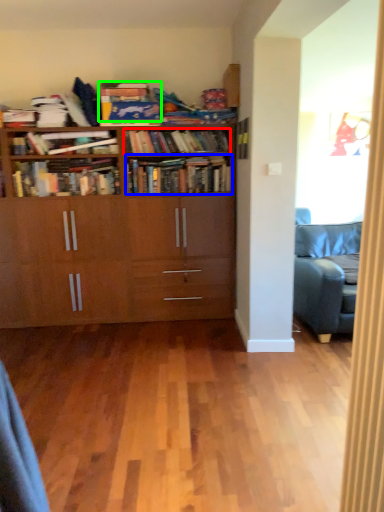
Question: Considering the real-world distances, which object is farthest from book (highlighted by a red box)? book (highlighted by a blue box) or book (highlighted by a green box)?

Choices:
 (A) book
 (B) book

Answer: (B)